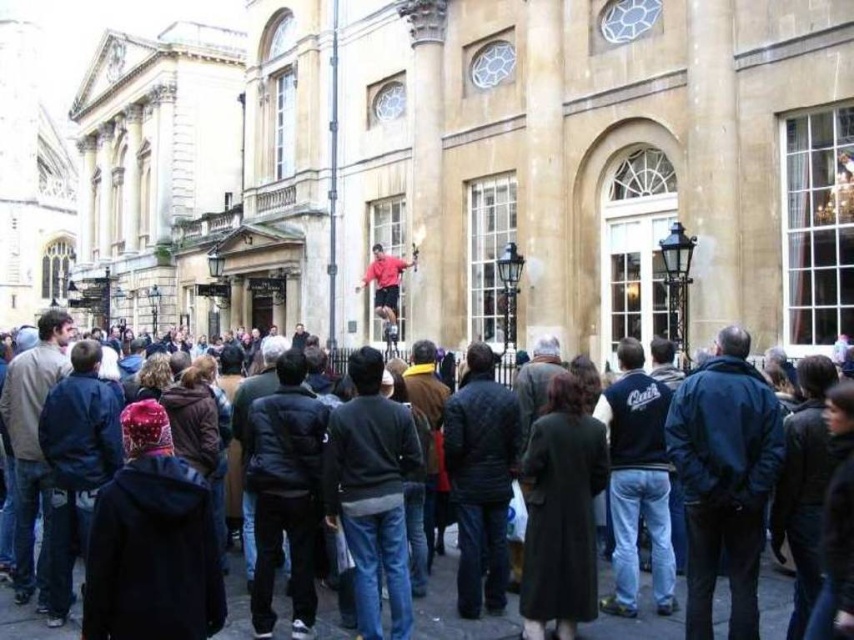
You are a photographer standing in front of the grand classical building. You want to take a photo of the performer in the center. Which object, the red jacket at center or the matte red shirt at center, is wider in the image?

The red jacket at center might be wider than matte red shirt at center according to the description.

You are standing at the entrance of the grand classical building and want to find the red jacket at center. According to the coordinates provided, in which direction should you look to locate it?

The red jacket at center is located at coordinates point (454,605). Since the entrance is at the center of the building, you should look slightly to the right and a bit downward to find the red jacket at center.